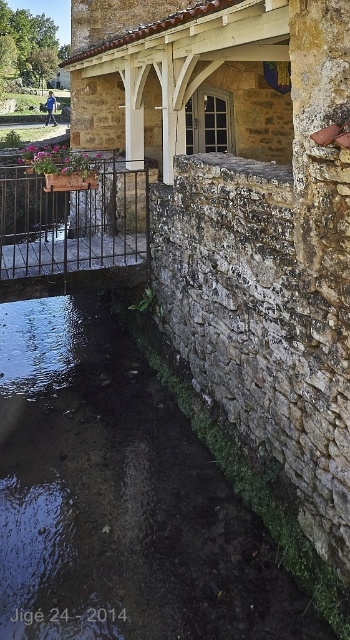
Question: Which point is closer to the camera?

Choices:
 (A) dark stone river at lower left
 (B) metallic black railing at center

Answer: (A)

Question: Is dark stone river at lower left closer to the viewer compared to metallic black railing at center?

Choices:
 (A) yes
 (B) no

Answer: (A)

Question: Which point is farther to the camera?

Choices:
 (A) metallic black railing at center
 (B) dark stone river at lower left

Answer: (A)

Question: Where is dark stone river at lower left located in relation to metallic black railing at center in the image?

Choices:
 (A) left
 (B) right

Answer: (B)

Question: Can you confirm if dark stone river at lower left is positioned to the left of metallic black railing at center?

Choices:
 (A) no
 (B) yes

Answer: (A)